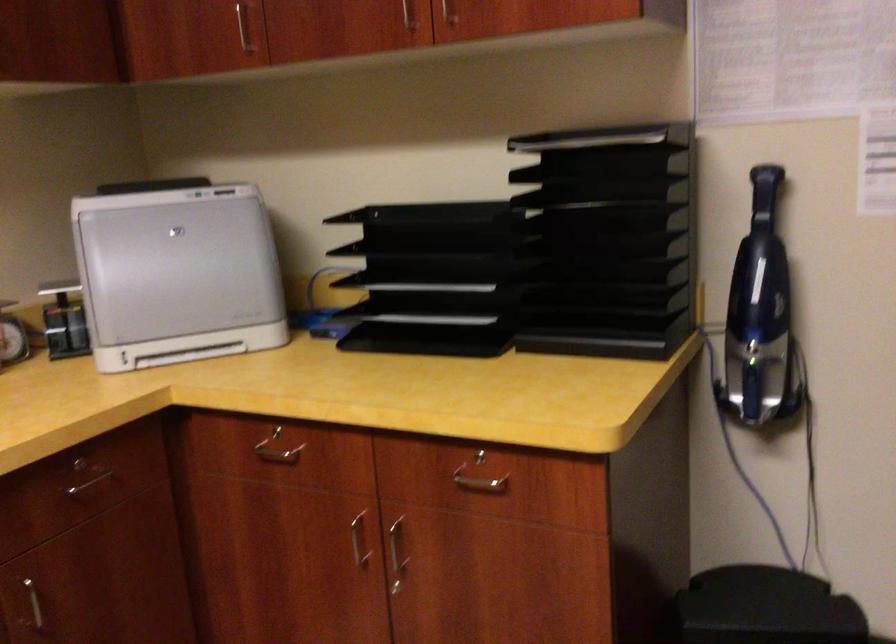
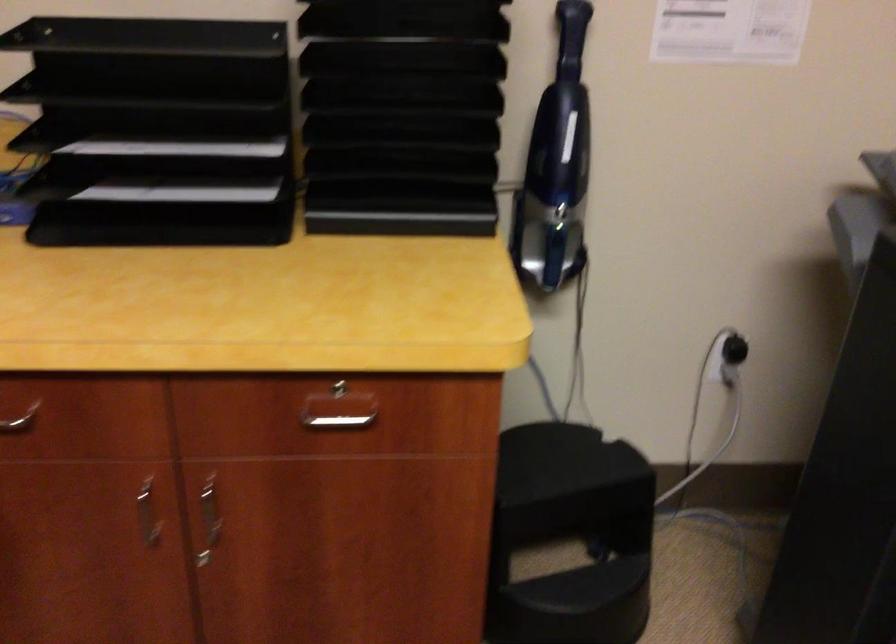
Where in the second image is the point corresponding to pixel 365 545 from the first image?

(148, 514)